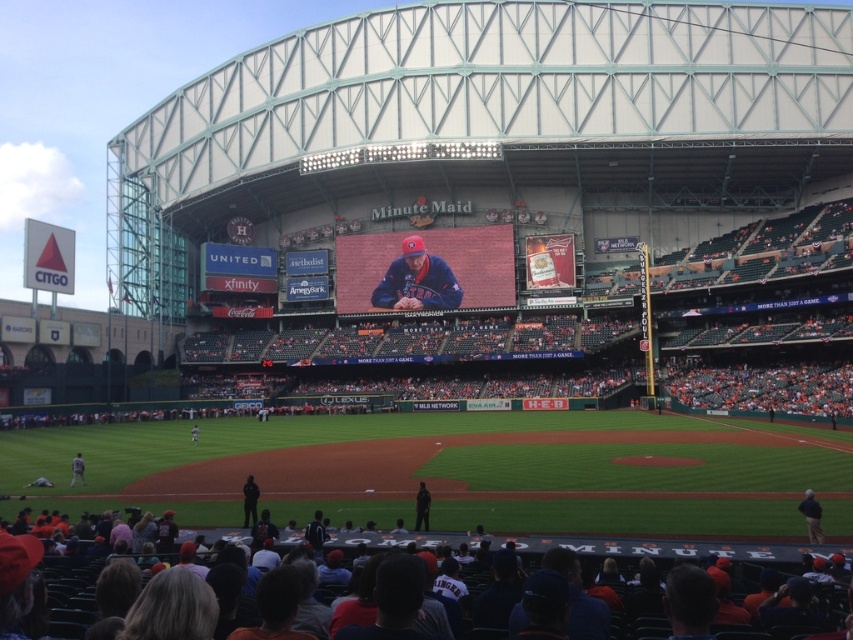
Question: Does matte blue cap at center appear over gray fabric jacket at center?

Choices:
 (A) yes
 (B) no

Answer: (A)

Question: Which object is the farthest from the dark blue jersey at lower center?

Choices:
 (A) matte blue cap at center
 (B) gray fabric jacket at center
 (C) black uniform at lower center
 (D) gray fabric jacket at lower left

Answer: (A)

Question: Which point is farther to the camera?

Choices:
 (A) black uniform at center
 (B) dark blue jersey at lower center
 (C) black uniform at lower center

Answer: (C)

Question: Is matte blue cap at center above black uniform at center?

Choices:
 (A) yes
 (B) no

Answer: (A)

Question: Considering the real-world distances, which object is closest to the matte blue cap at center?

Choices:
 (A) black uniform at center
 (B) black uniform at lower center
 (C) black fabric jacket at lower right
 (D) dark blue jersey at lower center

Answer: (B)

Question: Where is dark blue jersey at lower center located in relation to gray fabric jacket at center in the image?

Choices:
 (A) left
 (B) right

Answer: (B)